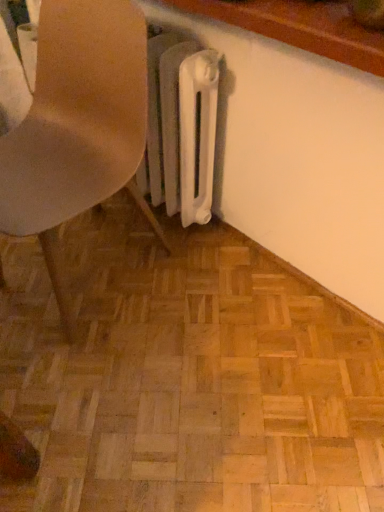
Question: Considering the relative positions of natural wood parquet floor at center and matte plastic chair at lower left in the image provided, is natural wood parquet floor at center to the left of matte plastic chair at lower left from the viewer's perspective?

Choices:
 (A) yes
 (B) no

Answer: (B)

Question: Does natural wood parquet floor at center have a greater height compared to matte plastic chair at lower left?

Choices:
 (A) yes
 (B) no

Answer: (B)

Question: Is the depth of natural wood parquet floor at center greater than that of matte plastic chair at lower left?

Choices:
 (A) yes
 (B) no

Answer: (A)

Question: Would you say natural wood parquet floor at center is outside matte plastic chair at lower left?

Choices:
 (A) yes
 (B) no

Answer: (A)

Question: Could you tell me if natural wood parquet floor at center is turned towards matte plastic chair at lower left?

Choices:
 (A) yes
 (B) no

Answer: (B)

Question: From the image's perspective, is natural wood parquet floor at center beneath matte plastic chair at lower left?

Choices:
 (A) yes
 (B) no

Answer: (A)

Question: Is there a large distance between matte plastic chair at lower left and natural wood parquet floor at center?

Choices:
 (A) yes
 (B) no

Answer: (B)

Question: Considering the relative sizes of matte plastic chair at lower left and natural wood parquet floor at center in the image provided, is matte plastic chair at lower left shorter than natural wood parquet floor at center?

Choices:
 (A) yes
 (B) no

Answer: (B)

Question: Considering the relative sizes of matte plastic chair at lower left and natural wood parquet floor at center in the image provided, is matte plastic chair at lower left thinner than natural wood parquet floor at center?

Choices:
 (A) yes
 (B) no

Answer: (A)

Question: Does matte plastic chair at lower left have a smaller size compared to natural wood parquet floor at center?

Choices:
 (A) no
 (B) yes

Answer: (A)

Question: Is matte plastic chair at lower left looking in the opposite direction of natural wood parquet floor at center?

Choices:
 (A) no
 (B) yes

Answer: (A)

Question: Is matte plastic chair at lower left touching natural wood parquet floor at center?

Choices:
 (A) no
 (B) yes

Answer: (A)

Question: Is point (119, 29) closer or farther from the camera than point (170, 422)?

Choices:
 (A) farther
 (B) closer

Answer: (B)